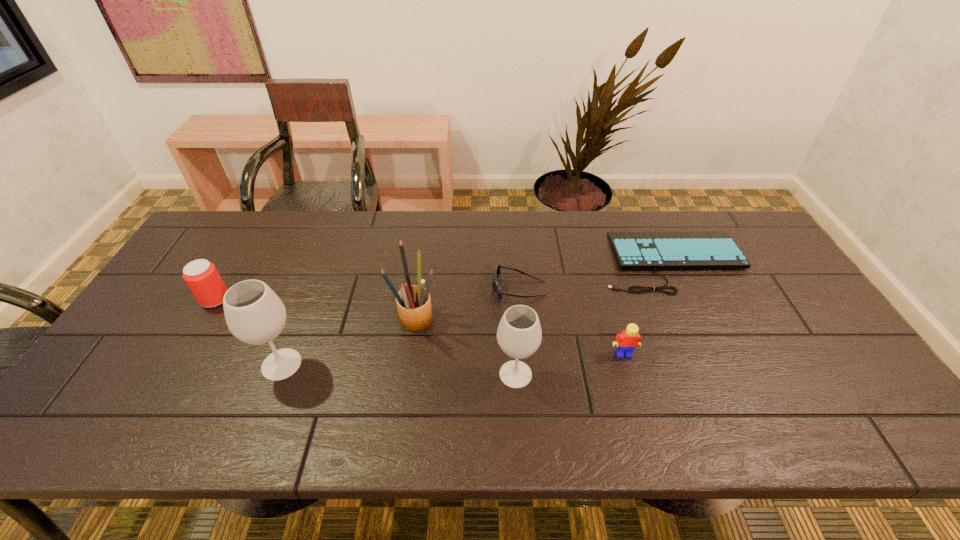
Observe the arrangement of all wineglasss in the image. To keep them evenly spaced, where would you place another wineglass on the right? Please locate a free space. Please provide its 2D coordinates. Your answer should be formatted as a tuple, i.e. [(x, y)], where the tuple contains the x and y coordinates of a point satisfying the conditions above.

[(758, 384)]